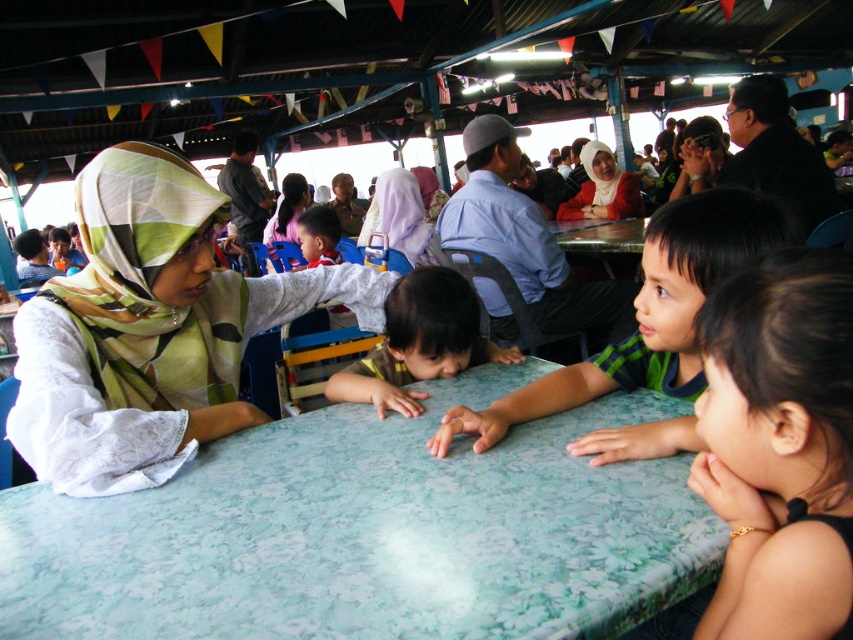
Question: Which point is closer to the camera?

Choices:
 (A) dark brown hair at lower right
 (B) green textured shirt at center
 (C) white lace shirt at center
 (D) matte red scarf at center

Answer: (A)

Question: Is green floral tablecloth at center below dark brown hair at lower right?

Choices:
 (A) no
 (B) yes

Answer: (B)

Question: Is white lace shirt at center positioned behind dark brown hair at lower right?

Choices:
 (A) yes
 (B) no

Answer: (A)

Question: Considering the relative positions of light purple fabric headscarf at center and matte red scarf at center in the image provided, where is light purple fabric headscarf at center located with respect to matte red scarf at center?

Choices:
 (A) left
 (B) right

Answer: (A)

Question: Estimate the real-world distances between objects in this image. Which object is farther from the green floral tablecloth at center?

Choices:
 (A) light purple fabric headscarf at center
 (B) matte red scarf at center

Answer: (B)

Question: Among these points, which one is farthest from the camera?

Choices:
 (A) (474, 332)
 (B) (321, 268)

Answer: (B)